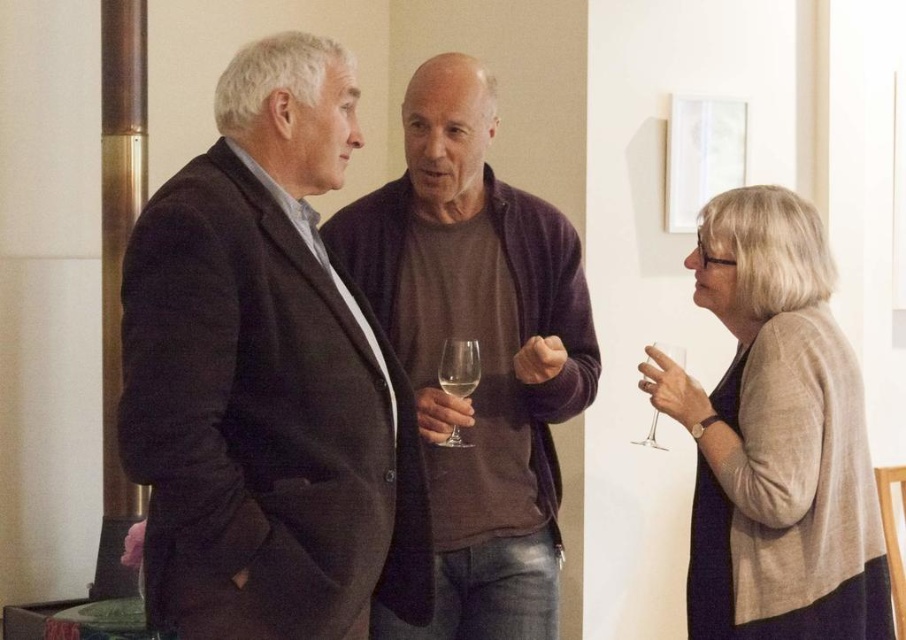
You are standing at the origin of the coordinate system in the image. Which of the two points, point (465, 349) or point (682, 355), is closer to you?

Point (465, 349) is in front of point (682, 355), so it is closer to you.

You are organizing a charity event and need to arrange seating based on the width of the attendees clothing. The dark brown suit at center and brown cotton sweater at center are two participants. Which clothing item should be seated in a narrower chair?

The dark brown suit at center should be seated in a narrower chair because its width is less than the brown cotton sweater at center.